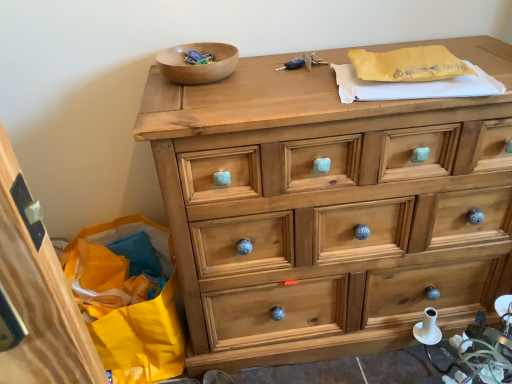
Question: From a real-world perspective, is light brown wood chest of drawers at center above or below wooden bowl at upper center?

Choices:
 (A) above
 (B) below

Answer: (B)

Question: Looking at the image, does light brown wood chest of drawers at center seem bigger or smaller compared to wooden bowl at upper center?

Choices:
 (A) big
 (B) small

Answer: (A)

Question: Does point (173, 213) appear closer or farther from the camera than point (202, 66)?

Choices:
 (A) closer
 (B) farther

Answer: (A)

Question: From the image's perspective, relative to light brown wood chest of drawers at center, is wooden bowl at upper center above or below?

Choices:
 (A) above
 (B) below

Answer: (A)

Question: In the image, is wooden bowl at upper center on the left side or the right side of light brown wood chest of drawers at center?

Choices:
 (A) right
 (B) left

Answer: (B)

Question: Is point (228, 49) closer or farther from the camera than point (311, 76)?

Choices:
 (A) farther
 (B) closer

Answer: (A)

Question: Is wooden bowl at upper center in front of or behind light brown wood chest of drawers at center in the image?

Choices:
 (A) front
 (B) behind

Answer: (B)